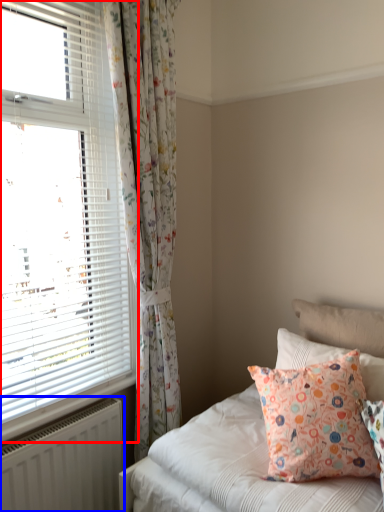
Question: Which of the following is the closest to the observer, window (highlighted by a red box) or radiator (highlighted by a blue box)?

Choices:
 (A) window
 (B) radiator

Answer: (A)